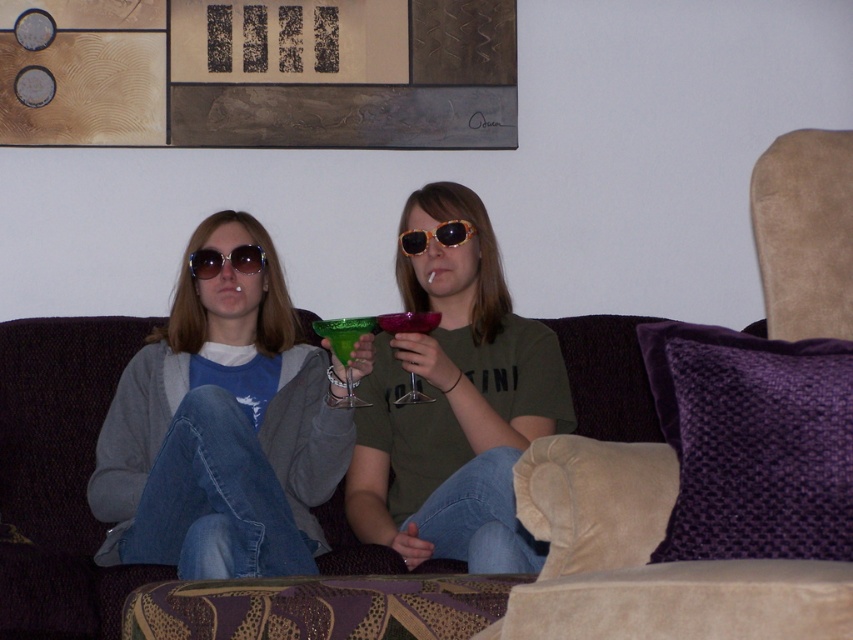
Can you confirm if purple fabric couch at center is positioned above suede armchair at right?

Incorrect, purple fabric couch at center is not positioned above suede armchair at right.

Which is more to the left, purple fabric couch at center or suede armchair at right?

Positioned to the left is purple fabric couch at center.

Where is `purple fabric couch at center`? The height and width of the screenshot is (640, 853). purple fabric couch at center is located at coordinates (59, 476).

At what (x,y) coordinates should I click in order to perform the action: click on purple fabric couch at center. Please return your answer as a coordinate pair (x, y). Image resolution: width=853 pixels, height=640 pixels. Looking at the image, I should click on (59, 476).

Does matte gray sweater at center lie behind green glass at center?

No, it is in front of green glass at center.

Between matte gray sweater at center and green glass at center, which one is positioned higher?

Positioned higher is green glass at center.

Is point (317, 358) closer to camera compared to point (316, 324)?

No, (317, 358) is further to viewer.

Where is `matte gray sweater at center`? matte gray sweater at center is located at coordinates (221, 428).

Between green matte glass at center and sunglasses at center, which one is positioned higher?

Positioned higher is sunglasses at center.

Looking at this image, is green matte glass at center thinner than sunglasses at center?

In fact, green matte glass at center might be wider than sunglasses at center.

The image size is (853, 640). Identify the location of green matte glass at center. (454, 404).